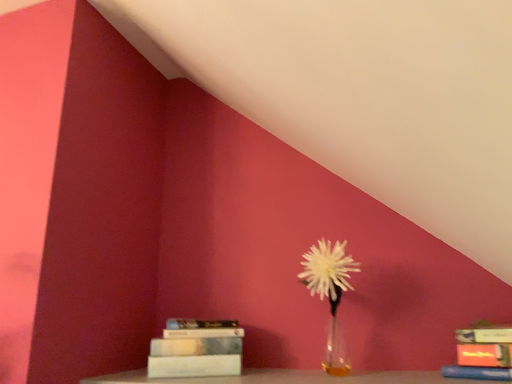
Question: Can we say translucent glass vase at center lies outside hardcover book at lower right, acting as the second book starting from the back?

Choices:
 (A) yes
 (B) no

Answer: (A)

Question: Is translucent glass vase at center positioned far away from hardcover book at lower right, marked as the 1th book in a front-to-back arrangement?

Choices:
 (A) no
 (B) yes

Answer: (A)

Question: From the image's perspective, does translucent glass vase at center appear lower than hardcover book at lower right, which appears as the 1th book when viewed from the right?

Choices:
 (A) yes
 (B) no

Answer: (A)

Question: Is translucent glass vase at center aimed at hardcover book at lower right, marked as the 1th book in a front-to-back arrangement?

Choices:
 (A) no
 (B) yes

Answer: (A)

Question: Is translucent glass vase at center taller than hardcover book at lower right, marked as the 1th book in a front-to-back arrangement?

Choices:
 (A) yes
 (B) no

Answer: (B)

Question: Considering the positions of hardcover book at lower right, which appears as the 1th book when viewed from the right, and translucent glass vase at center in the image, is hardcover book at lower right, which appears as the 1th book when viewed from the right, wider or thinner than translucent glass vase at center?

Choices:
 (A) wide
 (B) thin

Answer: (B)

Question: Based on their positions, is hardcover book at lower right, acting as the second book starting from the back, located to the left or right of translucent glass vase at center?

Choices:
 (A) right
 (B) left

Answer: (A)

Question: From the image's perspective, is hardcover book at lower right, marked as the 1th book in a front-to-back arrangement, located above or below translucent glass vase at center?

Choices:
 (A) above
 (B) below

Answer: (A)

Question: Which is correct: hardcover book at lower right, which is the second book from left to right, is inside translucent glass vase at center, or outside of it?

Choices:
 (A) inside
 (B) outside

Answer: (B)

Question: In terms of size, does hardcover book at lower left, the 1th book positioned from the back, appear bigger or smaller than translucent glass vase at center?

Choices:
 (A) big
 (B) small

Answer: (B)

Question: From the image's perspective, is hardcover book at lower left, the first book from the left, positioned above or below translucent glass vase at center?

Choices:
 (A) below
 (B) above

Answer: (B)

Question: Do you think hardcover book at lower left, the 1th book positioned from the back, is within translucent glass vase at center, or outside of it?

Choices:
 (A) inside
 (B) outside

Answer: (B)

Question: Based on their positions, is hardcover book at lower left, the first book from the left, located to the left or right of translucent glass vase at center?

Choices:
 (A) left
 (B) right

Answer: (A)

Question: Do you think hardcover book at lower left, positioned as the second book in front-to-back order, is within hardcover book at lower right, marked as the 1th book in a front-to-back arrangement, or outside of it?

Choices:
 (A) inside
 (B) outside

Answer: (B)

Question: From the image's perspective, relative to hardcover book at lower right, marked as the 1th book in a front-to-back arrangement, is hardcover book at lower left, the 2th book from the right, above or below?

Choices:
 (A) above
 (B) below

Answer: (B)